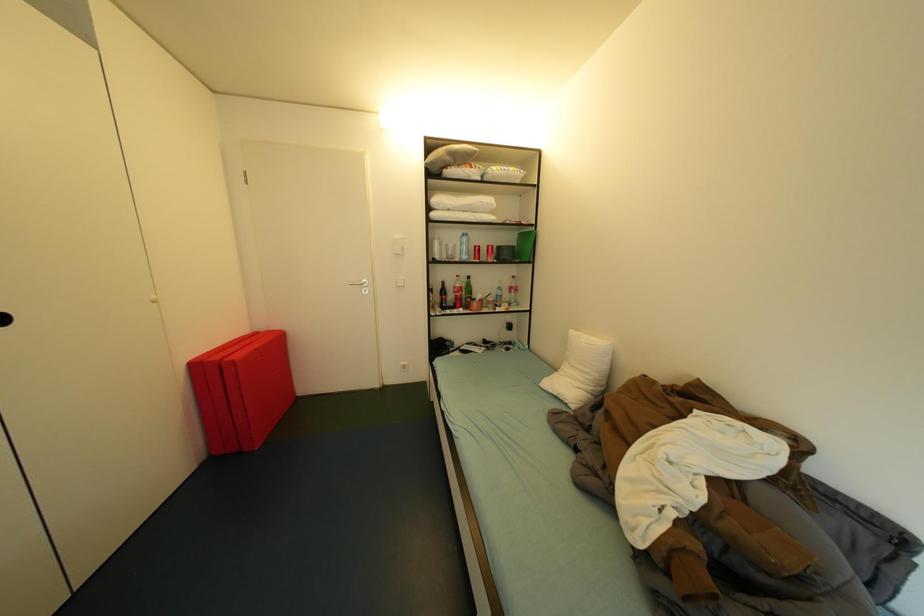
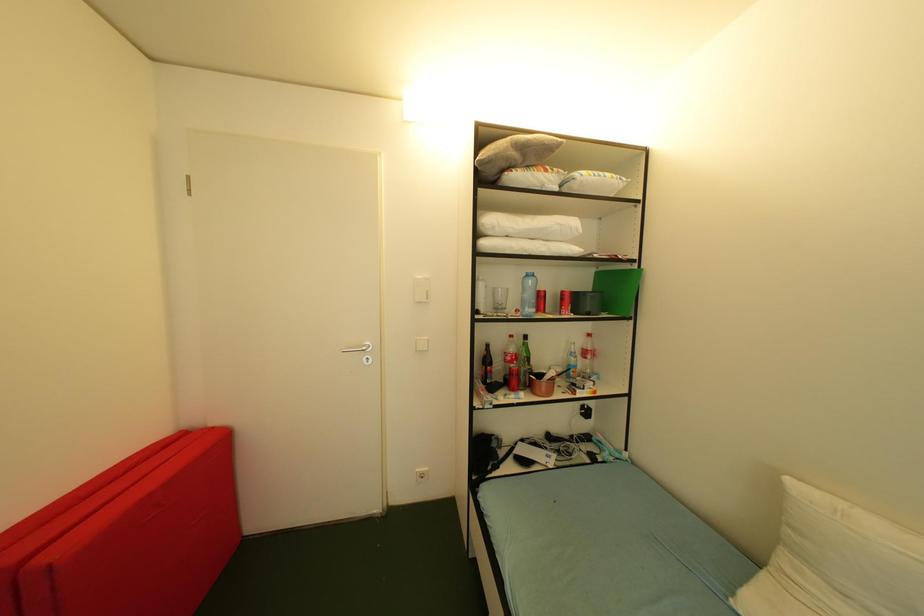
Question: Based on the continuous images, in which direction is the camera rotating? Reply with the corresponding letter.

Choices:
 (A) Left
 (B) Right
 (C) Up
 (D) Down

Answer: (C)